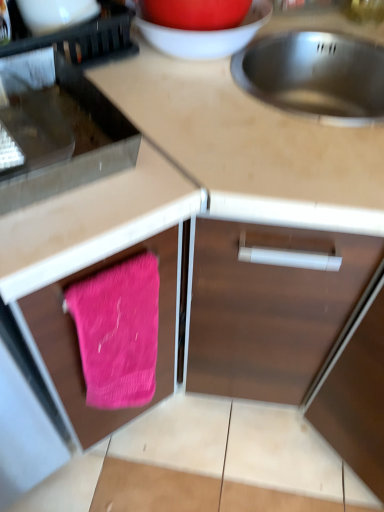
The image size is (384, 512). What do you see at coordinates (250, 145) in the screenshot? I see `metallic stainless steel sink at upper right` at bounding box center [250, 145].

Image resolution: width=384 pixels, height=512 pixels. What do you see at coordinates (205, 35) in the screenshot? I see `matte white bowl at upper center` at bounding box center [205, 35].

What is the approximate height of pink fabric at lower left?

pink fabric at lower left is 33.98 inches in height.

Image resolution: width=384 pixels, height=512 pixels. Find the location of `metallic stainless steel sink at upper right`. metallic stainless steel sink at upper right is located at coordinates (250, 145).

In the scene shown: Visually, is pink knitted towel at lower left positioned to the left or to the right of pink fabric at lower left?

In the image, pink knitted towel at lower left appears on the right side of pink fabric at lower left.

Are pink knitted towel at lower left and pink fabric at lower left far apart?

No, pink knitted towel at lower left is not far from pink fabric at lower left.

Does pink knitted towel at lower left turn towards pink fabric at lower left?

No.

How distant is pink knitted towel at lower left from pink fabric at lower left?

10.46 centimeters.

Are metallic stainless steel sink at upper right and metallic stainless steel oven at left, positioned as the second appliance in top-to-bottom order, far apart?

That's not correct — metallic stainless steel sink at upper right is a little close to metallic stainless steel oven at left, positioned as the second appliance in top-to-bottom order.

Is metallic stainless steel sink at upper right positioned with its back to metallic stainless steel oven at left, the second appliance positioned from the bottom?

metallic stainless steel sink at upper right does not have its back to metallic stainless steel oven at left, the second appliance positioned from the bottom.

Considering the relative positions of metallic stainless steel sink at upper right and metallic stainless steel oven at left, the second appliance in the right-to-left sequence, in the image provided, is metallic stainless steel sink at upper right to the left of metallic stainless steel oven at left, the second appliance in the right-to-left sequence, from the viewer's perspective?

Incorrect, metallic stainless steel sink at upper right is not on the left side of metallic stainless steel oven at left, the second appliance in the right-to-left sequence.

Is metallic stainless steel sink at upper right shorter than metallic stainless steel oven at left, arranged as the 2th appliance when viewed from the left?

No.

Is black plastic dish rack at upper left, which ranks as the 3th appliance in bottom-to-top order, completely or partially outside of metallic stainless steel sink at upper right?

Indeed, black plastic dish rack at upper left, which ranks as the 3th appliance in bottom-to-top order, is completely outside metallic stainless steel sink at upper right.

How many degrees apart are the facing directions of black plastic dish rack at upper left, which is counted as the 1th appliance, starting from the left, and metallic stainless steel sink at upper right?

The facing directions of black plastic dish rack at upper left, which is counted as the 1th appliance, starting from the left, and metallic stainless steel sink at upper right are 84.7 degrees apart.

Is metallic stainless steel sink at upper right at the back of black plastic dish rack at upper left, marked as the third appliance in a right-to-left arrangement?

black plastic dish rack at upper left, marked as the third appliance in a right-to-left arrangement, is not turned away from metallic stainless steel sink at upper right.

Is black plastic dish rack at upper left, which ranks as the 3th appliance in bottom-to-top order, far from metallic stainless steel sink at upper right?

No, black plastic dish rack at upper left, which ranks as the 3th appliance in bottom-to-top order, is not far from metallic stainless steel sink at upper right.

From the image's perspective, between matte white bowl at upper center and metallic stainless steel sink at upper right, which one is located above?

matte white bowl at upper center appears higher in the image.

Is matte white bowl at upper center positioned with its back to metallic stainless steel sink at upper right?

No, matte white bowl at upper center is not facing the opposite direction of metallic stainless steel sink at upper right.

Considering the sizes of matte white bowl at upper center and metallic stainless steel sink at upper right in the image, is matte white bowl at upper center taller or shorter than metallic stainless steel sink at upper right?

Clearly, matte white bowl at upper center is shorter compared to metallic stainless steel sink at upper right.

From a real-world perspective, which is physically above, matte white bowl at upper center or metallic stainless steel sink at upper right?

matte white bowl at upper center is physically above.

Based on the photo, considering the relative sizes of pink fabric at lower left and wooden cabinet door at lower right, the 3th appliance viewed from the left, in the image provided, is pink fabric at lower left thinner than wooden cabinet door at lower right, the 3th appliance viewed from the left,?

In fact, pink fabric at lower left might be wider than wooden cabinet door at lower right, the 3th appliance viewed from the left.

How far apart are pink fabric at lower left and wooden cabinet door at lower right, which is counted as the first appliance, starting from the bottom?

pink fabric at lower left and wooden cabinet door at lower right, which is counted as the first appliance, starting from the bottom, are 17.08 inches apart from each other.

Does pink fabric at lower left have a lesser height compared to wooden cabinet door at lower right, which is counted as the first appliance, starting from the bottom?

Incorrect, the height of pink fabric at lower left does not fall short of that of wooden cabinet door at lower right, which is counted as the first appliance, starting from the bottom.

Considering the relative sizes of pink fabric at lower left and wooden cabinet door at lower right, which ranks as the 1th appliance in right-to-left order, in the image provided, is pink fabric at lower left smaller than wooden cabinet door at lower right, which ranks as the 1th appliance in right-to-left order,?

No, pink fabric at lower left is not smaller than wooden cabinet door at lower right, which ranks as the 1th appliance in right-to-left order.

From the image's perspective, is metallic stainless steel oven at left, the second appliance in the right-to-left sequence, above or below wooden cabinet door at lower right, which is counted as the first appliance, starting from the bottom?

metallic stainless steel oven at left, the second appliance in the right-to-left sequence, is above wooden cabinet door at lower right, which is counted as the first appliance, starting from the bottom.

Considering the relative sizes of metallic stainless steel oven at left, the second appliance positioned from the bottom, and wooden cabinet door at lower right, the third appliance positioned from the top, in the image provided, is metallic stainless steel oven at left, the second appliance positioned from the bottom, taller than wooden cabinet door at lower right, the third appliance positioned from the top,?

No.

From a real-world perspective, is metallic stainless steel oven at left, the second appliance positioned from the bottom, on top of wooden cabinet door at lower right, the 3th appliance viewed from the left?

Yes, from a real-world perspective, metallic stainless steel oven at left, the second appliance positioned from the bottom, is over wooden cabinet door at lower right, the 3th appliance viewed from the left

Is metallic stainless steel oven at left, the second appliance positioned from the bottom, not near wooden cabinet door at lower right, the 3th appliance viewed from the left?

They are positioned close to each other.

Relative to pink knitted towel at lower left, is pink fabric at lower left in front or behind?

In the image, pink fabric at lower left appears in front of pink knitted towel at lower left.

Is pink fabric at lower left facing towards pink knitted towel at lower left?

Yes, pink fabric at lower left is oriented towards pink knitted towel at lower left.

From a real-world perspective, is pink fabric at lower left located higher than pink knitted towel at lower left?

No.

Image resolution: width=384 pixels, height=512 pixels. What are the coordinates of `cabinetry above the pink knitted towel at lower left (from the image's perspective)` in the screenshot? It's located at (96, 222).

Identify the location of countertop located underneath the metallic stainless steel oven at left, the second appliance positioned from the bottom (from a real-world perspective). The image size is (384, 512). (250, 145).

Based on the photo, based on their spatial positions, is pink knitted towel at lower left or wooden cabinet door at lower right, the 3th appliance viewed from the left, closer to pink fabric at lower left?

The object closer to pink fabric at lower left is pink knitted towel at lower left.

When comparing their distances from pink fabric at lower left, does pink knitted towel at lower left or metallic stainless steel oven at left, positioned as the second appliance in top-to-bottom order, seem closer?

Result: pink knitted towel at lower left is positioned closer to the anchor pink fabric at lower left.

Which object lies nearer to the anchor point wooden cabinet door at lower right, the 3th appliance viewed from the left, matte white bowl at upper center or pink knitted towel at lower left?

pink knitted towel at lower left lies closer to wooden cabinet door at lower right, the 3th appliance viewed from the left, than the other object.

When comparing their distances from black plastic dish rack at upper left, arranged as the first appliance when viewed from the top, does metallic stainless steel sink at upper right or wooden cabinet door at lower right, the 3th appliance viewed from the left, seem closer?

metallic stainless steel sink at upper right.

Looking at the image, which one is located closer to pink fabric at lower left, matte white bowl at upper center or pink knitted towel at lower left?

pink knitted towel at lower left is closer to pink fabric at lower left.

When comparing their distances from metallic stainless steel oven at left, arranged as the 2th appliance when viewed from the left, does matte white bowl at upper center or wooden cabinet door at lower right, which ranks as the 1th appliance in right-to-left order, seem further?

Among the two, wooden cabinet door at lower right, which ranks as the 1th appliance in right-to-left order, is located further to metallic stainless steel oven at left, arranged as the 2th appliance when viewed from the left.

Based on their spatial positions, is metallic stainless steel sink at upper right or pink fabric at lower left further from black plastic dish rack at upper left, which ranks as the 3th appliance in bottom-to-top order?

Among the two, pink fabric at lower left is located further to black plastic dish rack at upper left, which ranks as the 3th appliance in bottom-to-top order.

Estimate the real-world distances between objects in this image. Which object is closer to pink fabric at lower left, metallic stainless steel oven at left, arranged as the 2th appliance when viewed from the left, or metallic stainless steel sink at upper right?

metallic stainless steel oven at left, arranged as the 2th appliance when viewed from the left.

Locate an element on the screen. The width and height of the screenshot is (384, 512). bath towel located between pink fabric at lower left and metallic stainless steel sink at upper right in the left-right direction is located at coordinates pos(118,332).

At what (x,y) coordinates should I click in order to perform the action: click on bath towel between pink fabric at lower left and wooden cabinet door at lower right, which is counted as the first appliance, starting from the bottom, in the horizontal direction. Please return your answer as a coordinate pair (x, y). Looking at the image, I should click on (118, 332).

Image resolution: width=384 pixels, height=512 pixels. I want to click on appliance situated between pink fabric at lower left and metallic stainless steel sink at upper right from left to right, so click(x=58, y=129).

You are a GUI agent. You are given a task and a screenshot of the screen. Output one action in this format:
    pyautogui.click(x=<x>, y=<y>)
    Task: Click on the bath towel located between metallic stainless steel oven at left, the second appliance in the right-to-left sequence, and wooden cabinet door at lower right, the 3th appliance viewed from the left, in the left-right direction
    
    Given the screenshot: What is the action you would take?
    pyautogui.click(x=118, y=332)